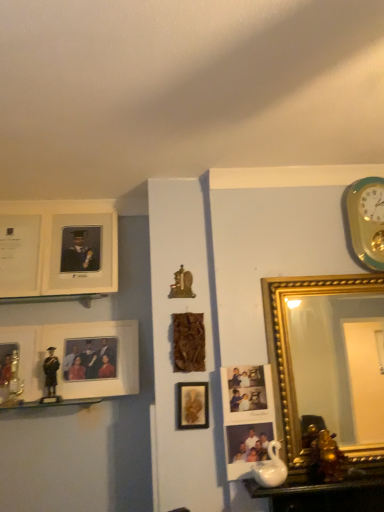
Question: Can matte white picture frame at left, which ranks as the 5th picture frame in left-to-right order, be found inside white matte picture frame at upper left, the first picture frame positioned from the left?

Choices:
 (A) no
 (B) yes

Answer: (A)

Question: Is white matte picture frame at upper left, arranged as the ninth picture frame when viewed from the right, directly adjacent to matte white picture frame at left, the 5th picture frame from the right?

Choices:
 (A) yes
 (B) no

Answer: (B)

Question: Can you confirm if white matte picture frame at upper left, the first picture frame positioned from the left, is thinner than matte white picture frame at left, which ranks as the 5th picture frame in left-to-right order?

Choices:
 (A) yes
 (B) no

Answer: (A)

Question: From the image's perspective, would you say white matte picture frame at upper left, the first picture frame positioned from the left, is positioned over matte white picture frame at left, which ranks as the 5th picture frame in left-to-right order?

Choices:
 (A) no
 (B) yes

Answer: (B)

Question: From the image's perspective, is white matte picture frame at upper left, the first picture frame positioned from the left, under matte white picture frame at left, which ranks as the 5th picture frame in left-to-right order?

Choices:
 (A) yes
 (B) no

Answer: (B)

Question: Based on their positions, is matte plastic photo frame at center, arranged as the 2th picture frame when viewed from the right, located to the left or right of matte white picture frame at upper left, the 6th picture frame in the right-to-left sequence?

Choices:
 (A) left
 (B) right

Answer: (B)

Question: Is matte plastic photo frame at center, which is the eighth picture frame in left-to-right order, wider or thinner than matte white picture frame at upper left, which is the fourth picture frame in left-to-right order?

Choices:
 (A) wide
 (B) thin

Answer: (B)

Question: Considering their positions, is matte plastic photo frame at center, arranged as the 2th picture frame when viewed from the right, located in front of or behind matte white picture frame at upper left, which is the fourth picture frame in left-to-right order?

Choices:
 (A) front
 (B) behind

Answer: (A)

Question: In terms of size, does matte plastic photo frame at center, arranged as the 2th picture frame when viewed from the right, appear bigger or smaller than matte white picture frame at upper left, the 6th picture frame in the right-to-left sequence?

Choices:
 (A) big
 (B) small

Answer: (B)

Question: Is point (342, 510) positioned closer to the camera than point (372, 181)?

Choices:
 (A) closer
 (B) farther

Answer: (A)

Question: Which is correct: white glossy table at lower right is inside teal-golden wall clock at upper right, or outside of it?

Choices:
 (A) outside
 (B) inside

Answer: (A)

Question: Is white glossy table at lower right wider or thinner than teal-golden wall clock at upper right?

Choices:
 (A) thin
 (B) wide

Answer: (B)

Question: Is white glossy table at lower right to the left or to the right of teal-golden wall clock at upper right in the image?

Choices:
 (A) right
 (B) left

Answer: (B)

Question: Would you say teal-golden wall clock at upper right is to the left or to the right of matte white picture frame at left, the 5th picture frame from the right, in the picture?

Choices:
 (A) left
 (B) right

Answer: (B)

Question: Considering the positions of teal-golden wall clock at upper right and matte white picture frame at left, which ranks as the 5th picture frame in left-to-right order, in the image, is teal-golden wall clock at upper right taller or shorter than matte white picture frame at left, which ranks as the 5th picture frame in left-to-right order,?

Choices:
 (A) tall
 (B) short

Answer: (B)